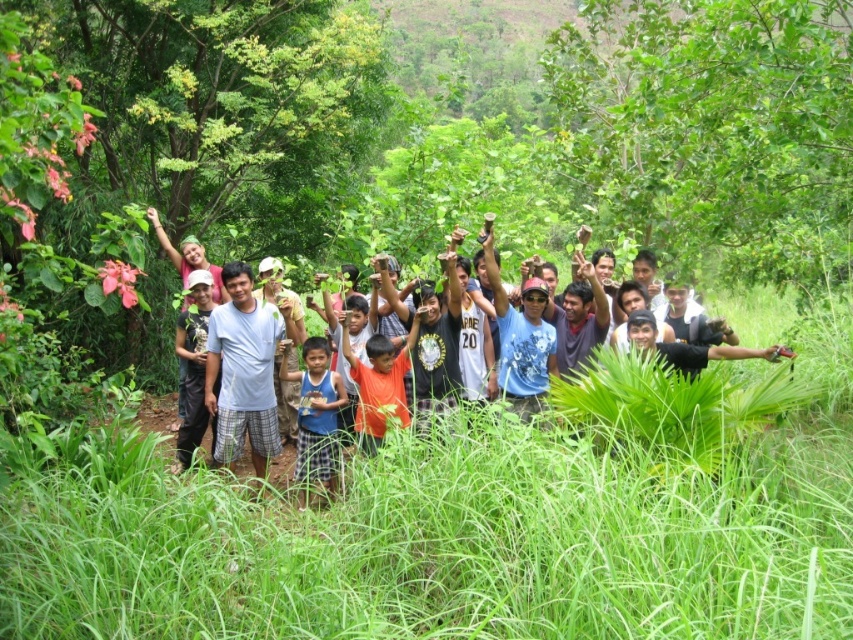
Is green leafy tree at left to the right of orange matte shirt at center from the viewer's perspective?

In fact, green leafy tree at left is to the left of orange matte shirt at center.

Who is shorter, green leafy tree at left or orange matte shirt at center?

green leafy tree at left is shorter.

Who is more distant from viewer, (253, 186) or (392, 392)?

The point (253, 186) is more distant.

Identify the location of green leafy tree at left. The height and width of the screenshot is (640, 853). (215, 115).

Is green leafy tree at left to the left of light blue t-shirt at center from the viewer's perspective?

Indeed, green leafy tree at left is positioned on the left side of light blue t-shirt at center.

In the scene shown: Which of these two, green leafy tree at left or light blue t-shirt at center, stands shorter?

With less height is green leafy tree at left.

Is point (163, 374) farther from camera compared to point (326, 355)?

That is True.

Locate an element on the screen. green leafy tree at left is located at coordinates (215, 115).

Is green leafy tree at center wider than light blue t-shirt at center?

Yes, green leafy tree at center is wider than light blue t-shirt at center.

Does green leafy tree at center have a lesser height compared to light blue t-shirt at center?

No.

Is point (718, 176) closer to viewer compared to point (445, 362)?

Yes.

Where is `green leafy tree at center`? The height and width of the screenshot is (640, 853). green leafy tree at center is located at coordinates (717, 129).